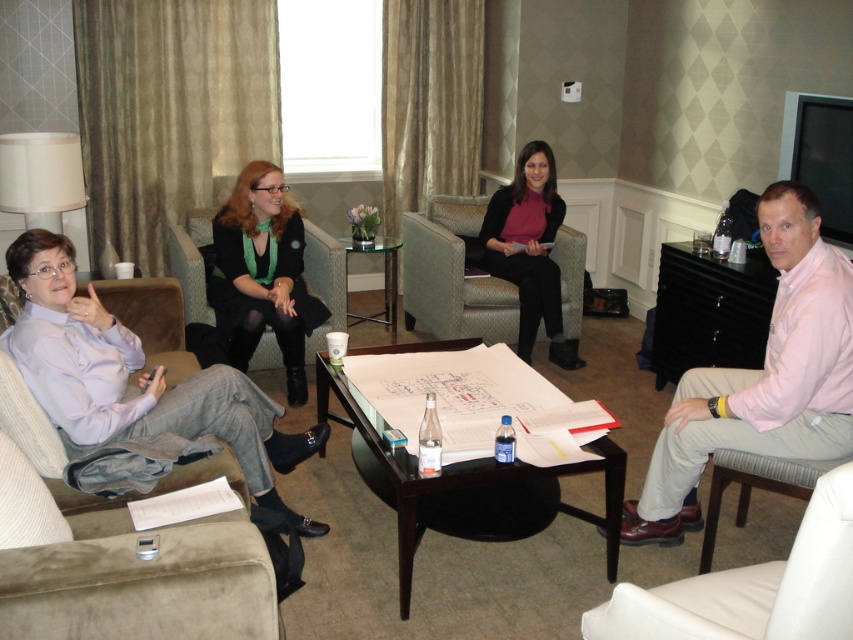
You are a service robot with a width of 2.5 feet. You need to move from the suede couch at left to the white leather chair at lower right. Can you fit through the space between them without moving any furniture?

The distance between the suede couch at left and the white leather chair at lower right is 4.02 feet. Since the robot is 2.5 feet wide, it can fit through the space as 4.02 feet is greater than 2.5 feet.

You are an interior designer planning to place a 2.5 meter long sofa in the meeting room. Given the current seating arrangement, which object from the suede couch at left and the white leather chair at lower right has enough space to accommodate the new sofa without rearrangement?

The suede couch at left has a larger width than the white leather chair at lower right, so the suede couch at left likely has more space to accommodate the new sofa without rearrangement.

You are an interior designer observing the meeting room. You need to place a floor lamp that requires a height clearance of 1.8 meters. Considering the suede couch at left and the pink cotton shirt at right, which object might interfere with the lamp placement due to its height?

The pink cotton shirt at right is taller than the suede couch at left, so it might interfere with the floor lamp placement if it exceeds the 1.8 meters height requirement.